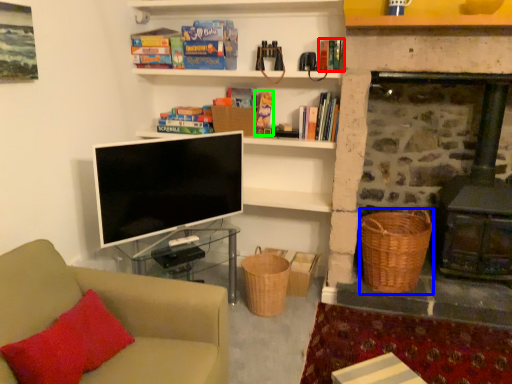
Question: Estimate the real-world distances between objects in this image. Which object is farther from book (highlighted by a red box), basket (highlighted by a blue box) or book (highlighted by a green box)?

Choices:
 (A) basket
 (B) book

Answer: (A)